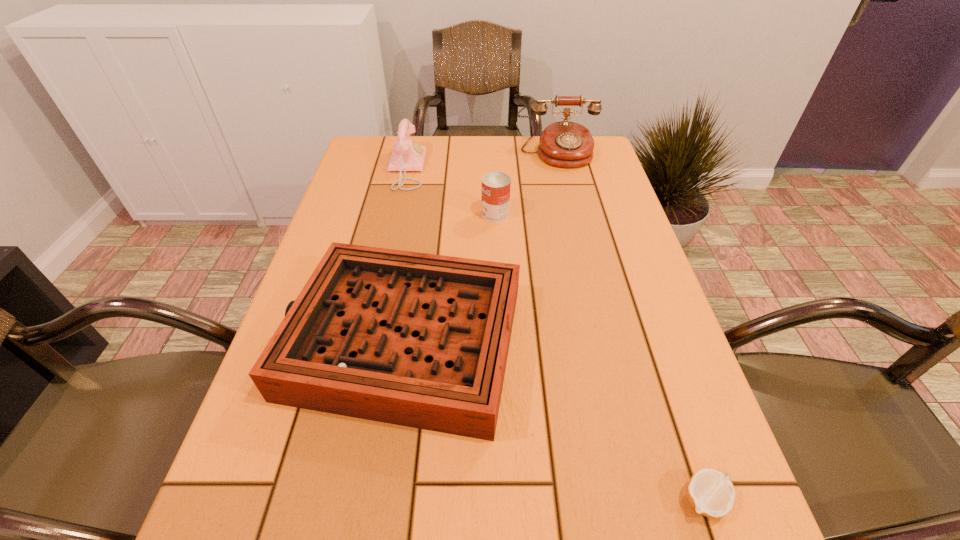
Image resolution: width=960 pixels, height=540 pixels. What are the coordinates of `the right telephone` in the screenshot? It's located at (566, 144).

Where is `the taller telephone`? the taller telephone is located at coordinates (x=566, y=144).

Where is `the shorter telephone`? The height and width of the screenshot is (540, 960). the shorter telephone is located at coordinates (407, 155).

Image resolution: width=960 pixels, height=540 pixels. I want to click on can, so click(496, 186).

Locate an element on the screen. Image resolution: width=960 pixels, height=540 pixels. gameboard is located at coordinates (414, 339).

This screenshot has width=960, height=540. In order to click on the fourth farthest object in this screenshot , I will do pyautogui.click(x=414, y=339).

I want to click on the nearest object, so [711, 493].

I want to click on lemon, so click(x=711, y=493).

Find the location of a particular element. blank space located 0.240m on the dial of the right telephone is located at coordinates (573, 218).

Locate an element on the screen. vacant space located on the dial of the left telephone is located at coordinates (444, 169).